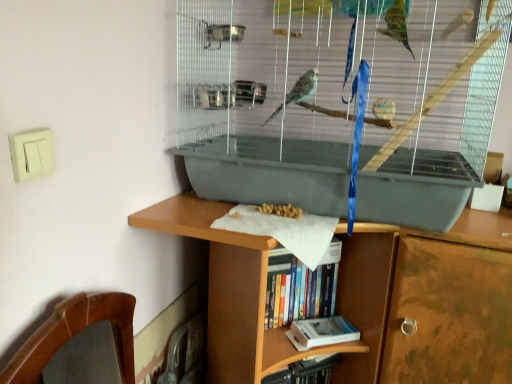
From the picture: Measure the distance between point (352, 333) and camera.

A distance of 1.16 meters exists between point (352, 333) and camera.

At what (x,y) coordinates should I click in order to perform the action: click on hardcover book at lower center, positioned as the 2th book in top-to-bottom order. Please return your answer as a coordinate pair (x, y). Looking at the image, I should click on (321, 332).

Measure the distance between point (351, 10) and camera.

The depth of point (351, 10) is 34.41 inches.

Find the location of a particular element. The height and width of the screenshot is (384, 512). gray plastic birdcage at center is located at coordinates (340, 103).

The image size is (512, 384). Find the location of `hardcover book at lower center, positioned as the 2th book in top-to-bottom order`. hardcover book at lower center, positioned as the 2th book in top-to-bottom order is located at coordinates (321, 332).

Considering the positions of objects hardcover book at lower center, positioned as the 2th book in top-to-bottom order, and hardcover book at center, which is counted as the 1th book, starting from the top, in the image provided, who is more to the right, hardcover book at lower center, positioned as the 2th book in top-to-bottom order, or hardcover book at center, which is counted as the 1th book, starting from the top,?

hardcover book at lower center, positioned as the 2th book in top-to-bottom order.

Considering the positions of point (354, 337) and point (306, 296), is point (354, 337) closer or farther from the camera than point (306, 296)?

Point (354, 337) appears to be closer to the viewer than point (306, 296).

Is hardcover book at lower center, positioned as the 2th book in top-to-bottom order, a part of hardcover book at center, which is counted as the 1th book, starting from the top?

No, hardcover book at lower center, positioned as the 2th book in top-to-bottom order, is not inside hardcover book at center, which is counted as the 1th book, starting from the top.

How many degrees apart are the facing directions of hardcover book at center, the second book positioned from the bottom, and hardcover book at lower center, the first book when ordered from bottom to top?

They differ by 3.15 degrees in their facing directions.

Is hardcover book at center, which is counted as the 1th book, starting from the top, not near hardcover book at lower center, positioned as the 2th book in top-to-bottom order?

No, there isn't a large distance between hardcover book at center, which is counted as the 1th book, starting from the top, and hardcover book at lower center, positioned as the 2th book in top-to-bottom order.

Which of these two, hardcover book at center, the second book positioned from the bottom, or hardcover book at lower center, positioned as the 2th book in top-to-bottom order, is bigger?

hardcover book at center, the second book positioned from the bottom.

Is hardcover book at lower center, positioned as the 2th book in top-to-bottom order, completely or partially outside of gray plastic birdcage at center?

Absolutely, hardcover book at lower center, positioned as the 2th book in top-to-bottom order, is external to gray plastic birdcage at center.

Does point (296, 343) appear closer or farther from the camera than point (180, 33)?

Point (296, 343) is farther from the camera than point (180, 33).

Which is in front, hardcover book at lower center, the first book when ordered from bottom to top, or gray plastic birdcage at center?

Positioned in front is gray plastic birdcage at center.

The height and width of the screenshot is (384, 512). Find the location of `book that is the 2nd one below the gray plastic birdcage at center (from a real-world perspective)`. book that is the 2nd one below the gray plastic birdcage at center (from a real-world perspective) is located at coordinates (321, 332).

From a real-world perspective, is hardcover book at center, which is counted as the 1th book, starting from the top, beneath gray plastic birdcage at center?

Indeed, from a real-world perspective, hardcover book at center, which is counted as the 1th book, starting from the top, is positioned beneath gray plastic birdcage at center.

Is point (333, 262) closer to camera compared to point (340, 90)?

Yes, point (333, 262) is in front of point (340, 90).

Which object is thinner, hardcover book at center, the second book positioned from the bottom, or gray plastic birdcage at center?

With smaller width is hardcover book at center, the second book positioned from the bottom.

Is hardcover book at center, the second book positioned from the bottom, oriented away from gray plastic birdcage at center?

hardcover book at center, the second book positioned from the bottom, does not have its back to gray plastic birdcage at center.

Where is `bird cage above the hardcover book at lower center, positioned as the 2th book in top-to-bottom order (from the image's perspective)`? The height and width of the screenshot is (384, 512). bird cage above the hardcover book at lower center, positioned as the 2th book in top-to-bottom order (from the image's perspective) is located at coordinates (340, 103).

Does gray plastic birdcage at center come behind hardcover book at lower center, positioned as the 2th book in top-to-bottom order?

No, it is in front of hardcover book at lower center, positioned as the 2th book in top-to-bottom order.

How many degrees apart are the facing directions of gray plastic birdcage at center and hardcover book at lower center, positioned as the 2th book in top-to-bottom order?

The facing directions of gray plastic birdcage at center and hardcover book at lower center, positioned as the 2th book in top-to-bottom order, are 38 degrees apart.

Consider the image. Does gray plastic birdcage at center have a greater height compared to hardcover book at lower center, the first book when ordered from bottom to top?

Correct, gray plastic birdcage at center is much taller as hardcover book at lower center, the first book when ordered from bottom to top.

How many degrees apart are the facing directions of gray plastic birdcage at center and hardcover book at center, which is counted as the 1th book, starting from the top?

There is a 41.2-degree angle between the facing directions of gray plastic birdcage at center and hardcover book at center, which is counted as the 1th book, starting from the top.

Is point (433, 138) closer or farther from the camera than point (303, 292)?

Clearly, point (433, 138) is closer to the camera than point (303, 292).

This screenshot has width=512, height=384. Identify the location of bird cage that is above the hardcover book at center, the second book positioned from the bottom (from a real-world perspective). (340, 103).

Between gray plastic birdcage at center and hardcover book at center, which is counted as the 1th book, starting from the top, which one has more height?

Standing taller between the two is gray plastic birdcage at center.

This screenshot has height=384, width=512. Find the location of `book on the right of hardcover book at center, the second book positioned from the bottom`. book on the right of hardcover book at center, the second book positioned from the bottom is located at coordinates (321, 332).

Identify the location of book behind the hardcover book at center, the second book positioned from the bottom. (321, 332).

When comparing their distances from gray plastic birdcage at center, does hardcover book at center, which is counted as the 1th book, starting from the top, or hardcover book at lower center, the first book when ordered from bottom to top, seem closer?

hardcover book at center, which is counted as the 1th book, starting from the top, is closer to gray plastic birdcage at center.

From the picture: From the image, which object appears to be nearer to hardcover book at lower center, positioned as the 2th book in top-to-bottom order, hardcover book at center, which is counted as the 1th book, starting from the top, or gray plastic birdcage at center?

The object closer to hardcover book at lower center, positioned as the 2th book in top-to-bottom order, is hardcover book at center, which is counted as the 1th book, starting from the top.

From the image, which object appears to be nearer to gray plastic birdcage at center, hardcover book at lower center, the first book when ordered from bottom to top, or hardcover book at center, which is counted as the 1th book, starting from the top?

hardcover book at center, which is counted as the 1th book, starting from the top, is closer to gray plastic birdcage at center.

Based on their spatial positions, is hardcover book at lower center, positioned as the 2th book in top-to-bottom order, or gray plastic birdcage at center further from hardcover book at center, the second book positioned from the bottom?

Among the two, gray plastic birdcage at center is located further to hardcover book at center, the second book positioned from the bottom.

When comparing their distances from hardcover book at lower center, the first book when ordered from bottom to top, does gray plastic birdcage at center or hardcover book at center, the second book positioned from the bottom, seem further?

gray plastic birdcage at center.

Based on their spatial positions, is gray plastic birdcage at center or hardcover book at lower center, the first book when ordered from bottom to top, further from hardcover book at center, the second book positioned from the bottom?

Based on the image, gray plastic birdcage at center appears to be further to hardcover book at center, the second book positioned from the bottom.

Identify the location of book between gray plastic birdcage at center and hardcover book at lower center, the first book when ordered from bottom to top, from top to bottom. This screenshot has width=512, height=384. (300, 287).